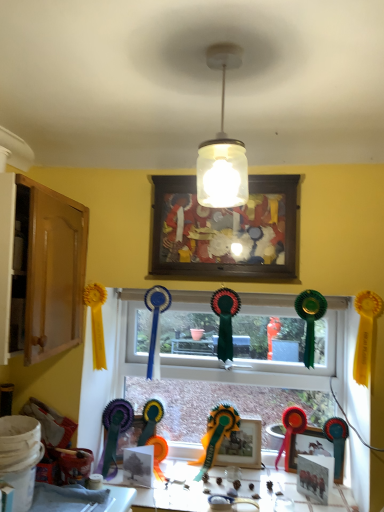
Locate an element on the screen. blank space to the left of shiny red ribbon at center, the second toy from the left is located at coordinates (260, 475).